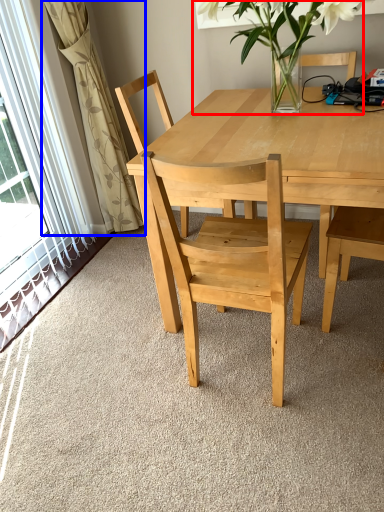
Question: Which object appears closest to the camera in this image, houseplant (highlighted by a red box) or curtain (highlighted by a blue box)?

Choices:
 (A) houseplant
 (B) curtain

Answer: (A)